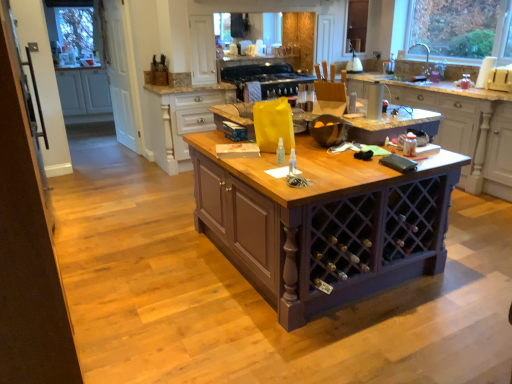
Question: Can you confirm if white wood cabinet at upper center, which appears as the second cabinetry when viewed from the left, is taller than purple wood cabinet at center, the first cabinetry from the right?

Choices:
 (A) no
 (B) yes

Answer: (A)

Question: Is white wood cabinet at upper center, marked as the second cabinetry in a front-to-back arrangement, outside purple wood cabinet at center, marked as the 3th cabinetry in a back-to-front arrangement?

Choices:
 (A) no
 (B) yes

Answer: (B)

Question: From a real-world perspective, is white wood cabinet at upper center, which is the 2th cabinetry from back to front, positioned under purple wood cabinet at center, marked as the 3th cabinetry in a back-to-front arrangement, based on gravity?

Choices:
 (A) yes
 (B) no

Answer: (A)

Question: Can you confirm if white wood cabinet at upper center, which is the 2th cabinetry from back to front, is positioned to the left of purple wood cabinet at center, the 1th cabinetry in the front-to-back sequence?

Choices:
 (A) no
 (B) yes

Answer: (B)

Question: Is the surface of white wood cabinet at upper center, which appears as the second cabinetry when viewed from the left, in direct contact with purple wood cabinet at center, which ranks as the third cabinetry in left-to-right order?

Choices:
 (A) yes
 (B) no

Answer: (B)

Question: Does white wood cabinet at upper center, marked as the second cabinetry in a front-to-back arrangement, have a lesser height compared to purple wood cabinet at center, marked as the 3th cabinetry in a back-to-front arrangement?

Choices:
 (A) no
 (B) yes

Answer: (B)

Question: Can you confirm if purple wood table at center is shorter than white glossy kettle at upper center, which is the first appliance in right-to-left order?

Choices:
 (A) no
 (B) yes

Answer: (A)

Question: Is purple wood table at center smaller than white glossy kettle at upper center, the 2th appliance when ordered from front to back?

Choices:
 (A) yes
 (B) no

Answer: (B)

Question: Does purple wood table at center have a greater height compared to white glossy kettle at upper center, acting as the second appliance starting from the left?

Choices:
 (A) no
 (B) yes

Answer: (B)

Question: Does purple wood table at center contain white glossy kettle at upper center, the first appliance viewed from the top?

Choices:
 (A) no
 (B) yes

Answer: (A)

Question: Is purple wood table at center wider than white glossy kettle at upper center, acting as the second appliance starting from the left?

Choices:
 (A) no
 (B) yes

Answer: (B)

Question: Is the position of purple wood table at center more distant than that of white glossy kettle at upper center, the 2th appliance when ordered from front to back?

Choices:
 (A) yes
 (B) no

Answer: (B)

Question: Is white matte cabinet at left, marked as the third cabinetry in a front-to-back arrangement, wider than clear glass door at left?

Choices:
 (A) yes
 (B) no

Answer: (A)